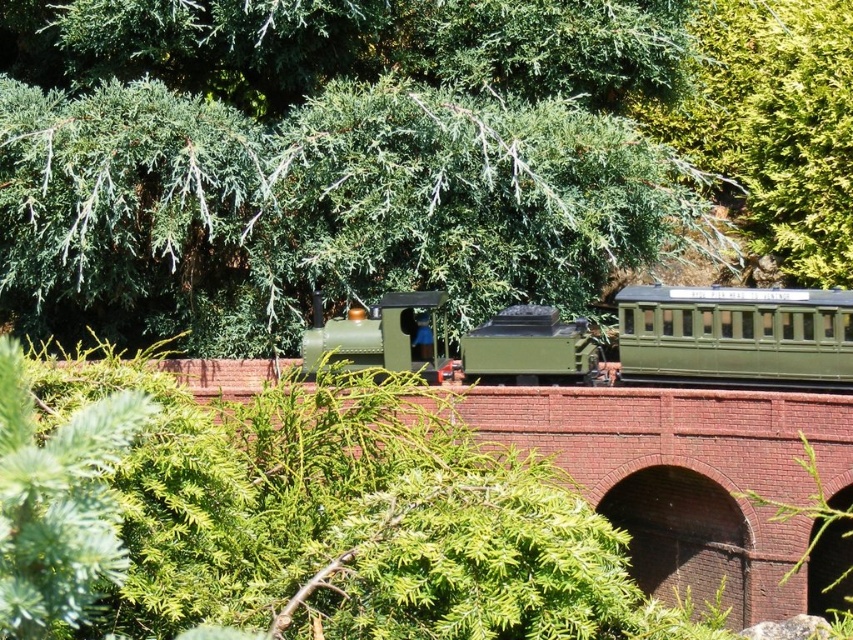
Is green leafy tree at upper center closer to camera compared to green matte steam train at center?

Yes.

Which of these two, green leafy tree at upper center or green matte steam train at center, stands taller?

green leafy tree at upper center is taller.

Between point (277, 131) and point (637, 323), which one is positioned in front?

Point (637, 323) is more forward.

Locate an element on the screen. Image resolution: width=853 pixels, height=640 pixels. green leafy tree at upper center is located at coordinates (403, 154).